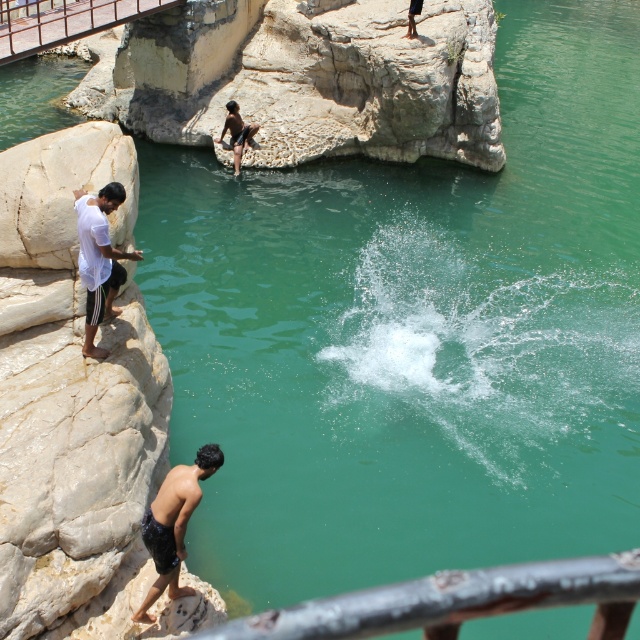
Is black matte shorts at lower left shorter than dark brown skin at center?

In fact, black matte shorts at lower left may be taller than dark brown skin at center.

Which is more to the right, black matte shorts at lower left or dark brown skin at center?

Positioned to the right is black matte shorts at lower left.

Where is `black matte shorts at lower left`? black matte shorts at lower left is located at coordinates (173, 524).

Is rusty metal rail at lower center to the left of black matte shorts at lower left from the viewer's perspective?

Incorrect, rusty metal rail at lower center is not on the left side of black matte shorts at lower left.

Who is more distant from viewer, (317, 634) or (170, 545)?

Positioned behind is point (170, 545).

Who is more forward, (x=524, y=577) or (x=172, y=576)?

Positioned in front is point (x=524, y=577).

Locate an element on the screen. This screenshot has width=640, height=640. rusty metal rail at lower center is located at coordinates (456, 602).

The image size is (640, 640). I want to click on brushed metal rail at upper left, so click(x=64, y=20).

Can you confirm if brushed metal rail at upper left is smaller than white matte shorts at left?

No.

I want to click on brushed metal rail at upper left, so click(64, 20).